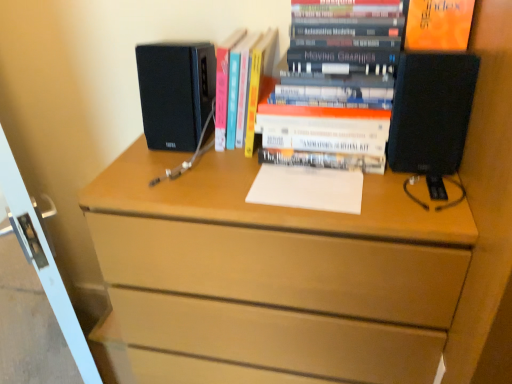
Image resolution: width=512 pixels, height=384 pixels. I want to click on vacant area that is in front of white paper at center, so click(x=313, y=213).